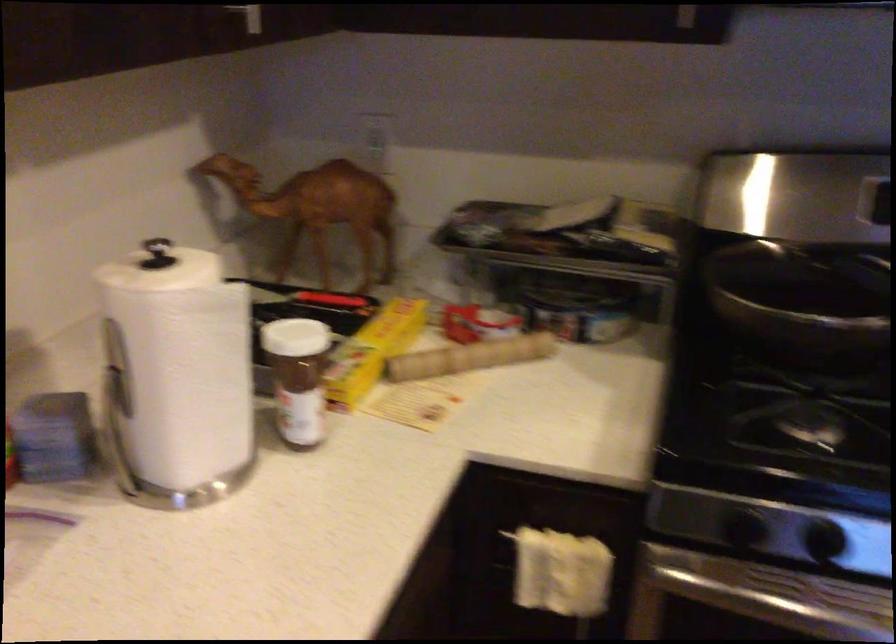
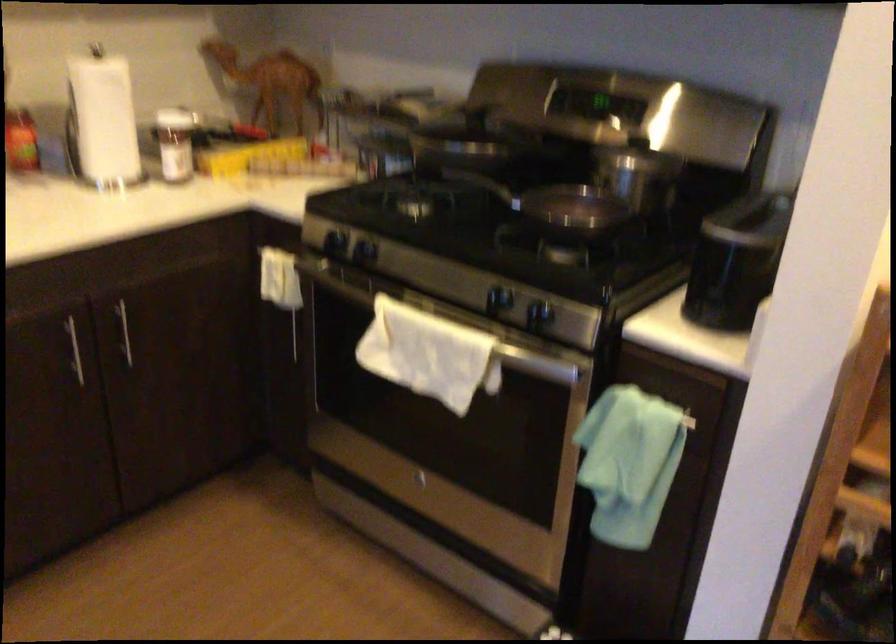
The images are taken continuously from a first-person perspective. In which direction are you moving?

The cameraman walked toward right, backward.